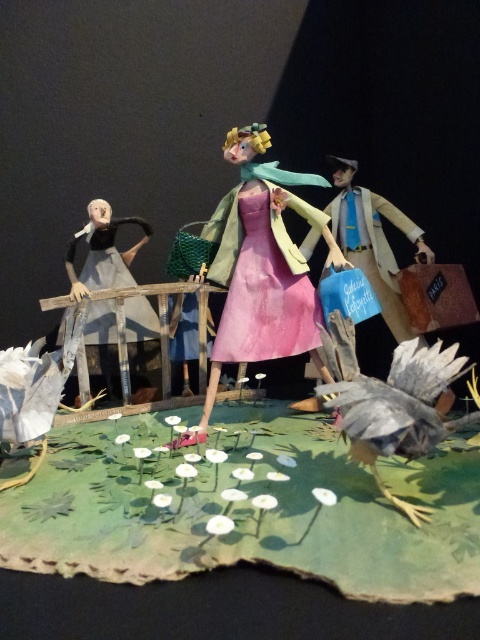
Question: Which of the following is the farthest from the observer?

Choices:
 (A) matte pink dress at center
 (B) matte gray dress at left

Answer: (B)

Question: In this image, where is matte pink dress at center located relative to matte gray dress at left?

Choices:
 (A) above
 (B) below

Answer: (B)

Question: Which object is positioned closest to the matte gray dress at left?

Choices:
 (A) gray paper bird at lower right
 (B) matte pink dress at center

Answer: (B)

Question: Does matte pink dress at center appear on the right side of gray paper bird at lower right?

Choices:
 (A) no
 (B) yes

Answer: (A)

Question: Which point is farther from the camera taking this photo?

Choices:
 (A) (307, 310)
 (B) (92, 220)

Answer: (B)

Question: Considering the relative positions of matte pink dress at center and gray paper bird at lower right in the image provided, where is matte pink dress at center located with respect to gray paper bird at lower right?

Choices:
 (A) right
 (B) left

Answer: (B)